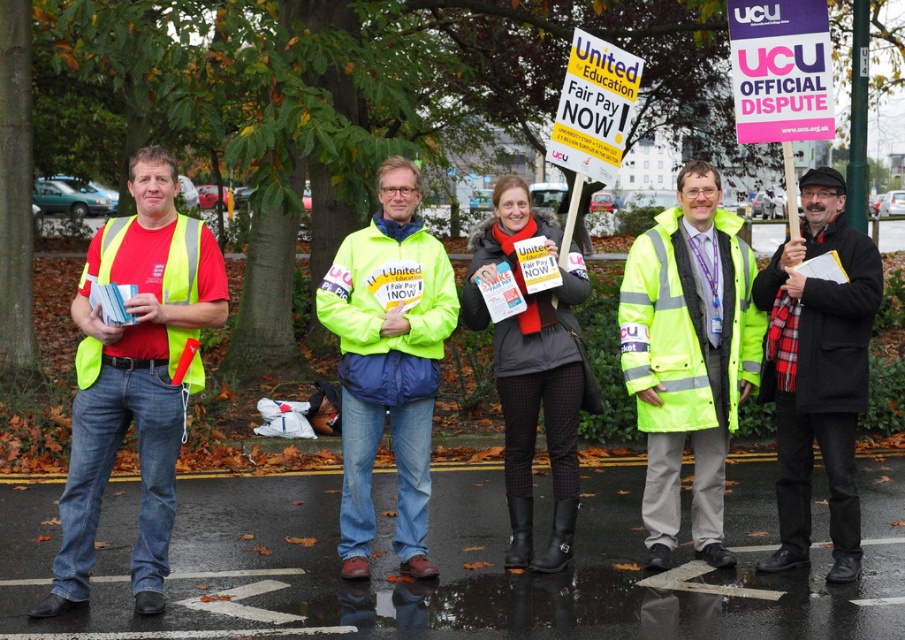
Question: Is matte yellow vest at left closer to camera compared to black wool scarf at center?

Choices:
 (A) yes
 (B) no

Answer: (A)

Question: Can you confirm if high visibility jacket at center is bigger than neon yellow jacket at center?

Choices:
 (A) yes
 (B) no

Answer: (A)

Question: Is matte yellow vest at left further to camera compared to high visibility yellow safety vest at left?

Choices:
 (A) yes
 (B) no

Answer: (B)

Question: Which of these objects is positioned closest to the high visibility jacket at center?

Choices:
 (A) black wool scarf at center
 (B) high visibility yellow safety vest at left
 (C) matte yellow vest at left

Answer: (A)

Question: Which of these objects is positioned closest to the high visibility jacket at center?

Choices:
 (A) neon yellow jacket at center
 (B) black wool scarf at center
 (C) black matte scarf at center

Answer: (B)

Question: Which of the following is the closest to the observer?

Choices:
 (A) (194, 385)
 (B) (784, 371)
 (C) (160, 516)

Answer: (C)